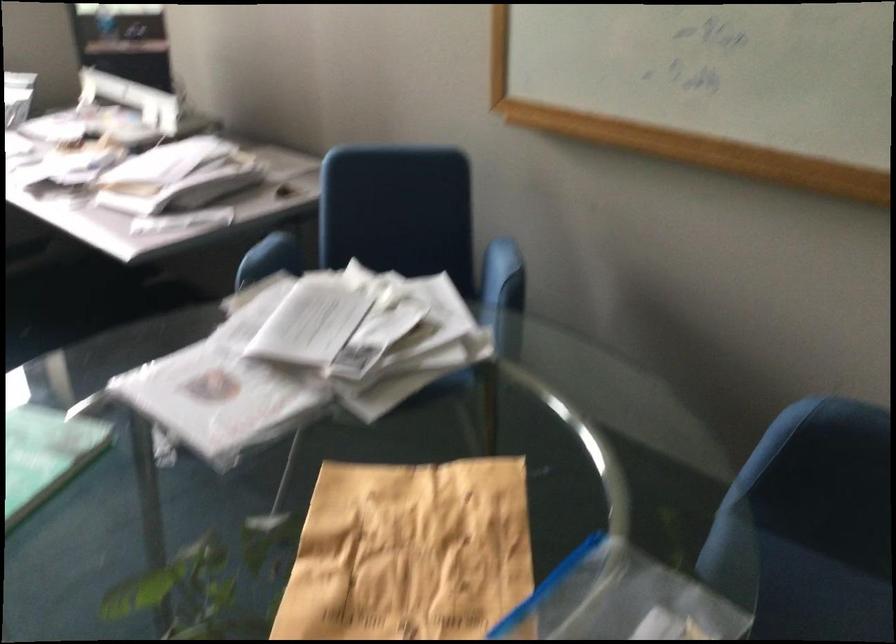
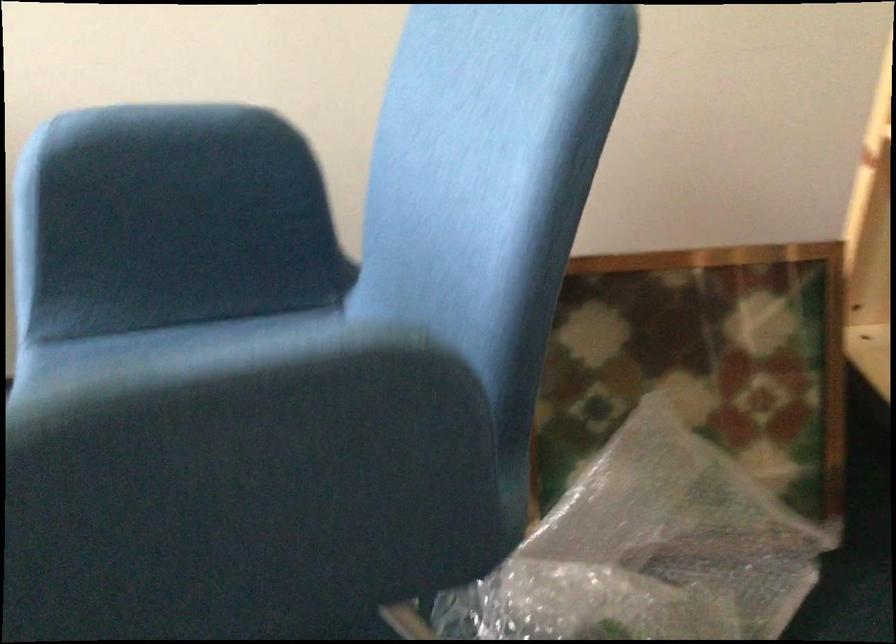
Question: The camera is either moving clockwise (left) or counter-clockwise (right) around the object. The first image is from the beginning of the video and the second image is from the end. Is the camera moving left or right when shooting the video?

Choices:
 (A) Left
 (B) Right

Answer: (A)